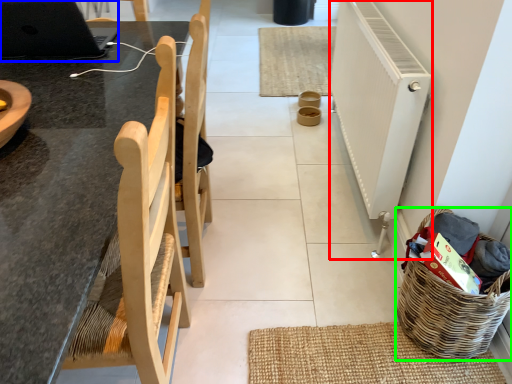
Question: Based on their relative distances, which object is nearer to radiator (highlighted by a red box)? Choose from laptop (highlighted by a blue box) and basket (highlighted by a green box).

Choices:
 (A) laptop
 (B) basket

Answer: (B)